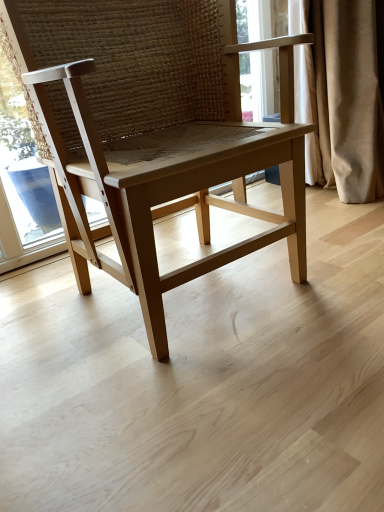
Locate an element on the screen. vacant space underneath light wood chair at center (from a real-world perspective) is located at coordinates (183, 293).